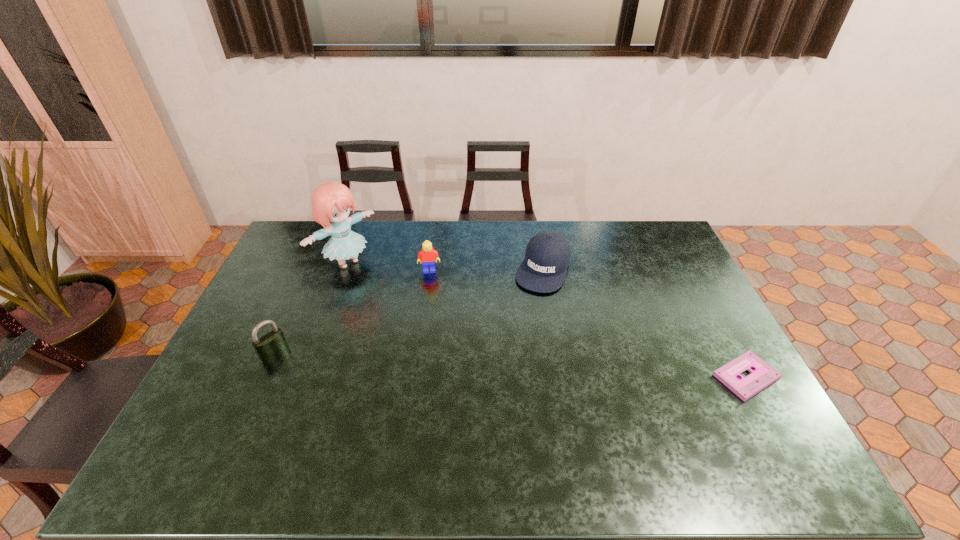
This screenshot has height=540, width=960. Find the location of `vacant space at the near right corner of the desktop`. vacant space at the near right corner of the desktop is located at coordinates (705, 407).

Identify the location of vacant area that lies between the padlock and the tallest object. 311,308.

I want to click on free space between the shortest object and the doll, so click(546, 319).

Where is `free space between the padlock and the videotape`? free space between the padlock and the videotape is located at coordinates (510, 365).

Image resolution: width=960 pixels, height=540 pixels. I want to click on unoccupied position between the third object from left to right and the tallest object, so click(388, 266).

Where is `vacant space that's between the second object from right to left and the padlock`? The image size is (960, 540). vacant space that's between the second object from right to left and the padlock is located at coordinates (409, 311).

Where is `empty space between the third object from left to right and the videotape`? empty space between the third object from left to right and the videotape is located at coordinates (588, 323).

This screenshot has height=540, width=960. In order to click on empty space between the fourth tallest object and the padlock in this screenshot , I will do `click(409, 311)`.

In order to click on vacant point located between the second object from right to left and the padlock in this screenshot , I will do 409,311.

Find the location of a particular element. The image size is (960, 540). vacant space that is in between the tallest object and the Lego is located at coordinates (388, 266).